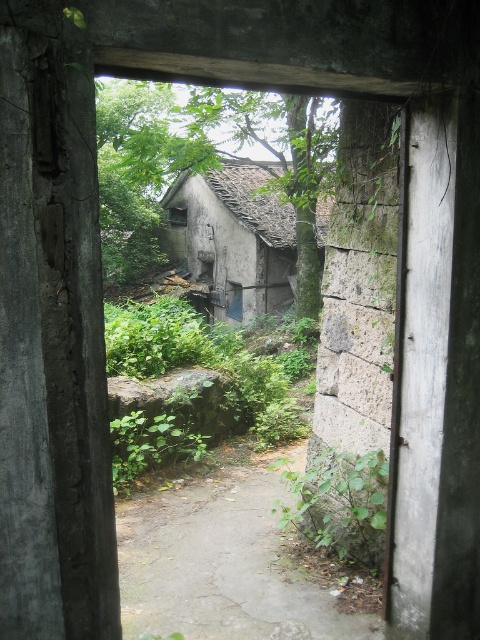
You are standing in front of the doorway and want to reach the weathered stone hut at center. Which direction should you move relative to the dull gray concrete path at center?

The dull gray concrete path at center is to the right of the weathered stone hut at center, so you should move to the left of the dull gray concrete path at center to reach the weathered stone hut at center.

You are standing in front of the weathered doorway and want to step onto the dull gray concrete path at center. Based on its position, where should you look to find it?

The dull gray concrete path at center is located at point 0.881 on the horizontal axis and 0.487 on the vertical axis.